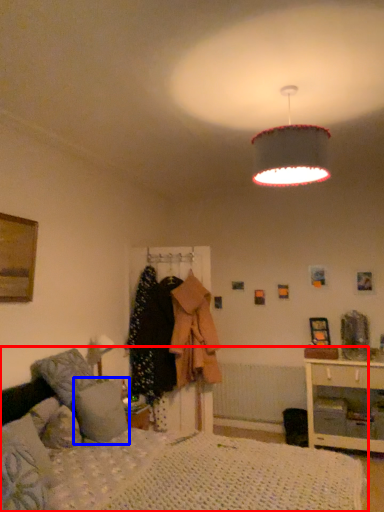
Question: Which object appears farthest to the camera in this image, bed (highlighted by a red box) or pillow (highlighted by a blue box)?

Choices:
 (A) bed
 (B) pillow

Answer: (B)